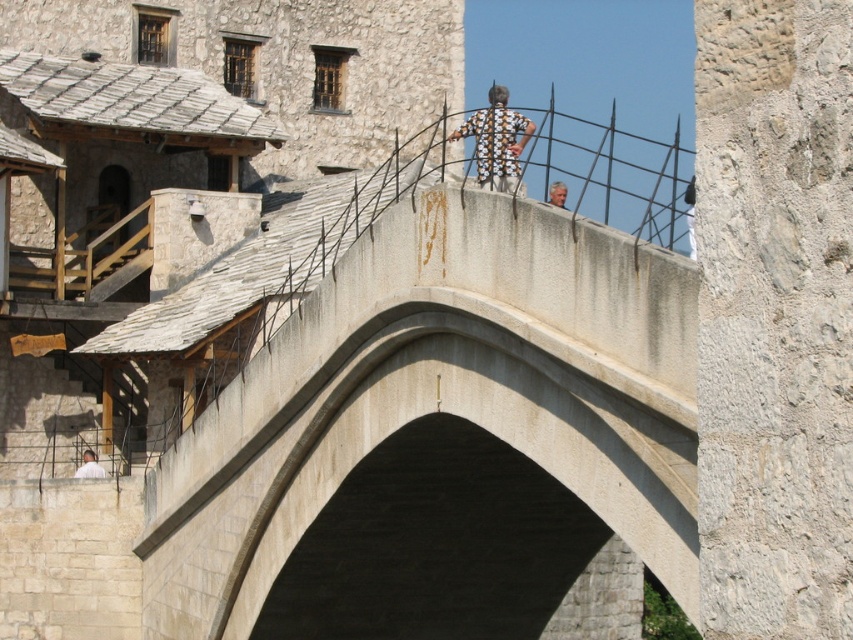
Looking at this image, you are an architect analyzing the proportions of the bridge and its surroundings. You notice the light gray stone person at lower left and the light brown hair at upper center. Which object has a smaller width?

The light gray stone person at lower left has a lesser width compared to the light brown hair at upper center.

From the picture: You are standing on the smooth concrete bridge at center and want to greet the light gray stone person at lower left. In which direction should you walk to reach them?

You should walk to the left because the smooth concrete bridge at center is to the right of the light gray stone person at lower left, so moving left will bring you towards them.